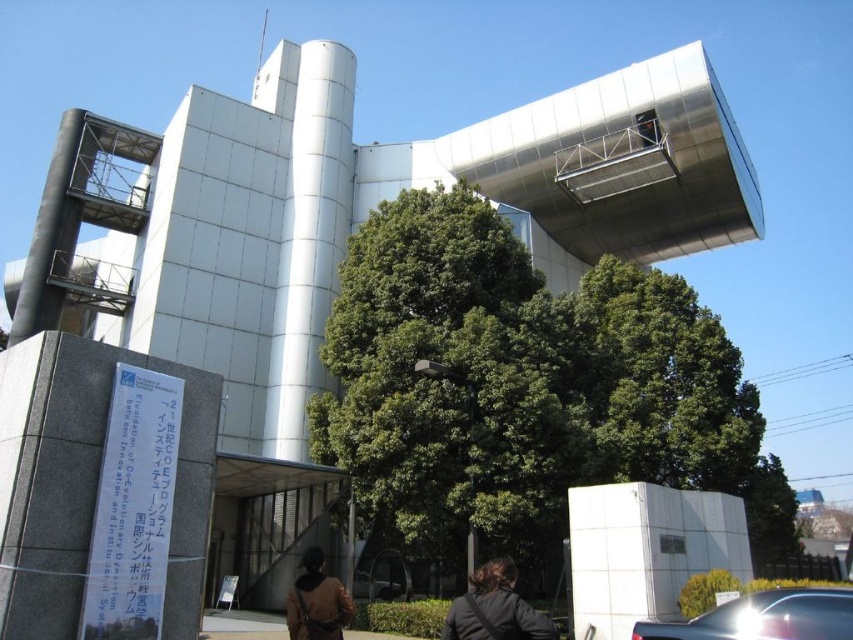
Question: Is shiny metallic car at lower right to the left of dark brown hair at lower center from the viewer's perspective?

Choices:
 (A) yes
 (B) no

Answer: (B)

Question: Does shiny metallic car at lower right appear over dark brown hair at lower center?

Choices:
 (A) no
 (B) yes

Answer: (B)

Question: Which of these objects is positioned closest to the dark brown hair at lower center?

Choices:
 (A) brown leather jacket at lower center
 (B) shiny metallic car at lower right

Answer: (A)

Question: Which of the following is the farthest from the observer?

Choices:
 (A) (468, 589)
 (B) (329, 588)
 (C) (757, 618)

Answer: (A)

Question: Is dark brown hair at lower center smaller than brown leather jacket at lower center?

Choices:
 (A) yes
 (B) no

Answer: (A)

Question: Which object is the farthest from the shiny metallic car at lower right?

Choices:
 (A) brown leather jacket at lower center
 (B) dark brown hair at lower center

Answer: (A)